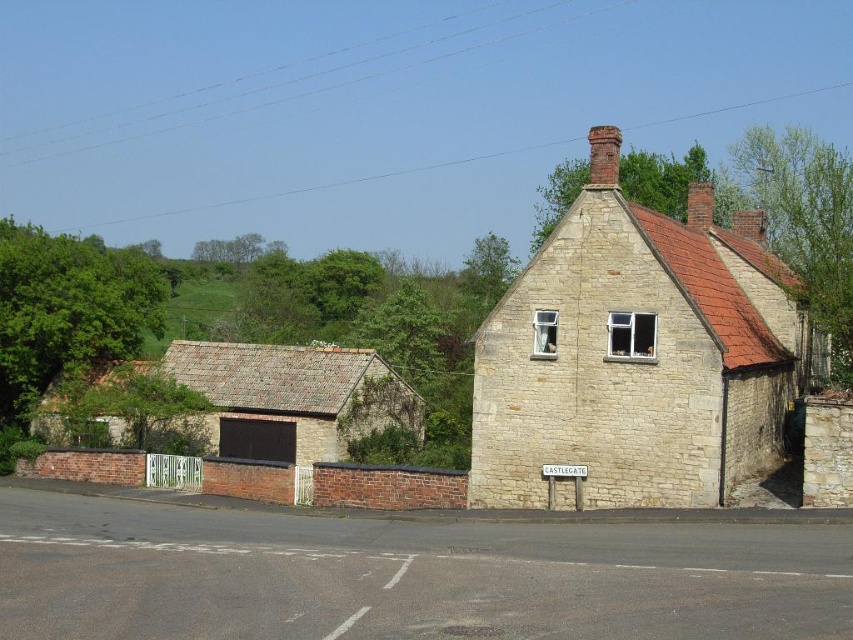
You are a delivery person trying to park your van between the stone cottage at center and the stone brick cottage at lower left. Given that your van is 2 meters wide, can you fit it in the space between them?

The stone cottage at center has a lesser width compared to stone brick cottage at lower left. However, the description does not provide the exact distance between the two buildings, so it is impossible to determine if the van can fit based on the given information.

You are a traveler who wants to know which building is larger between the stone cottage at center and the stone brick cottage at lower left. Which one should you choose if you need more space?

The stone cottage at center is bigger than the stone brick cottage at lower left, so you should choose the stone cottage at center for more space.